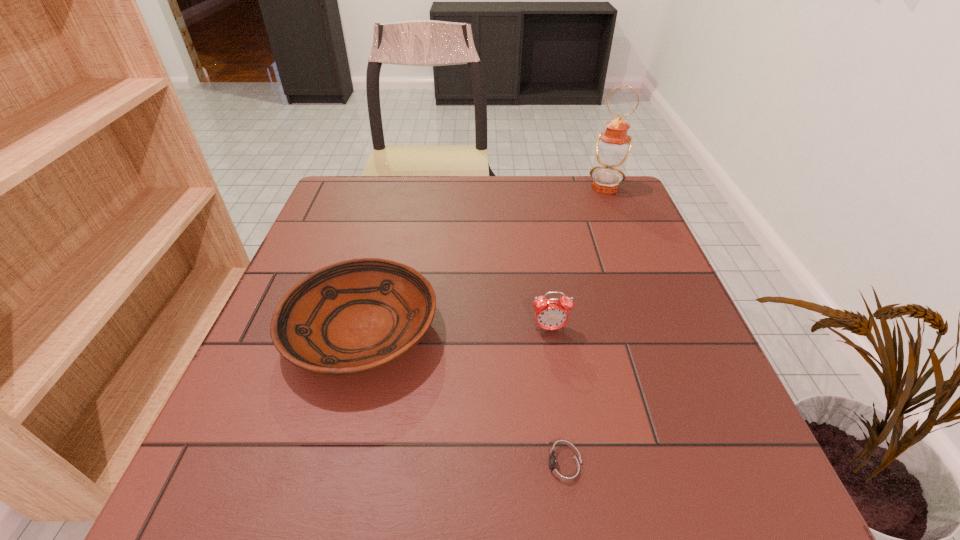
The width and height of the screenshot is (960, 540). I want to click on free region that satisfies the following two spatial constraints: 1. on the face of the third shortest object; 2. on the face of the nearest object, so click(x=570, y=467).